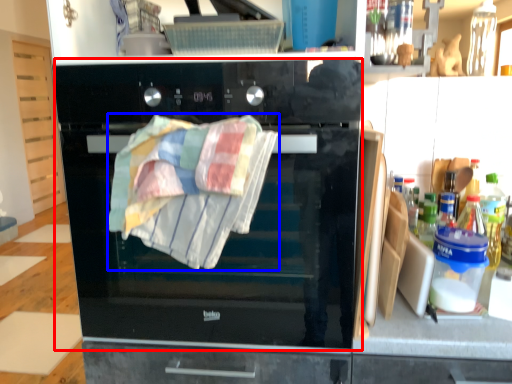
Question: Which object appears farthest to the camera in this image, oven (highlighted by a red box) or beach towel (highlighted by a blue box)?

Choices:
 (A) oven
 (B) beach towel

Answer: (A)